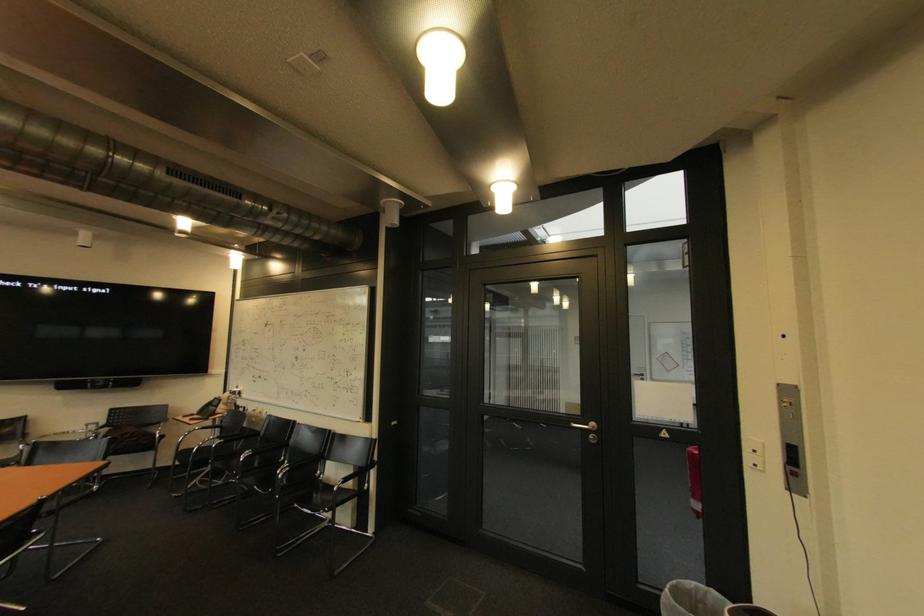
Where would you press the white light switch? Please return your answer as a coordinate pair (x, y).

(754, 454)